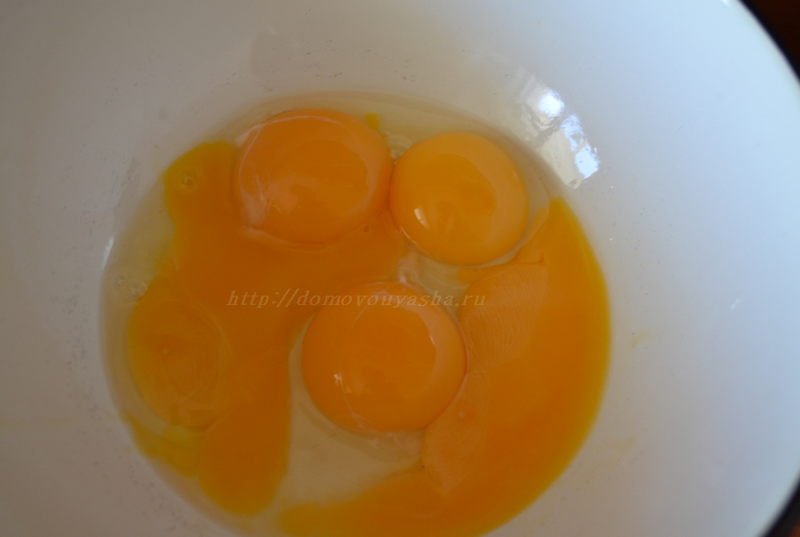
Where is `white bowl`? This screenshot has width=800, height=537. white bowl is located at coordinates (738, 199).